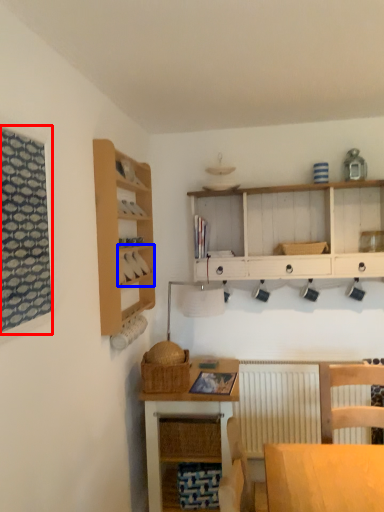
Question: Among these objects, which one is nearest to the camera, window (highlighted by a red box) or cabinet (highlighted by a blue box)?

Choices:
 (A) window
 (B) cabinet

Answer: (A)